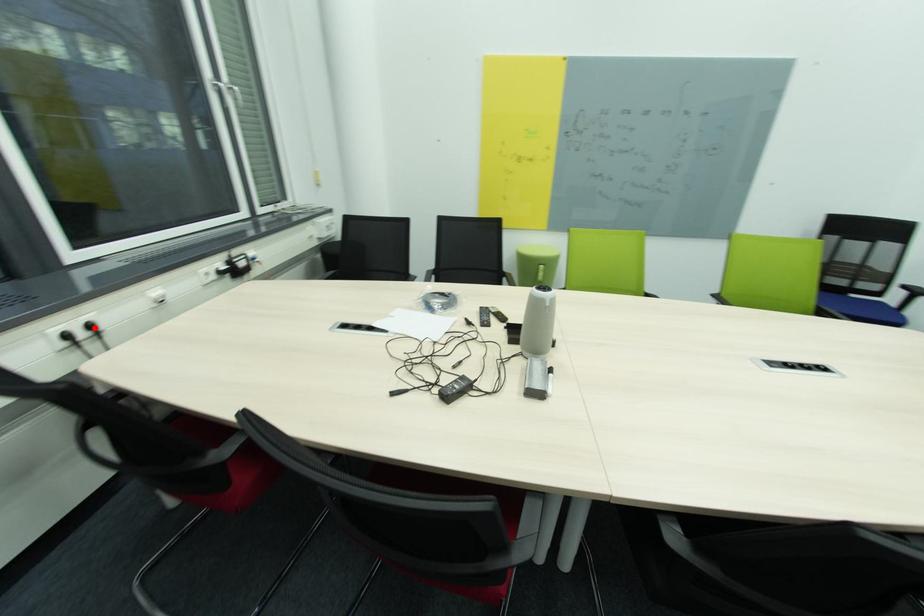
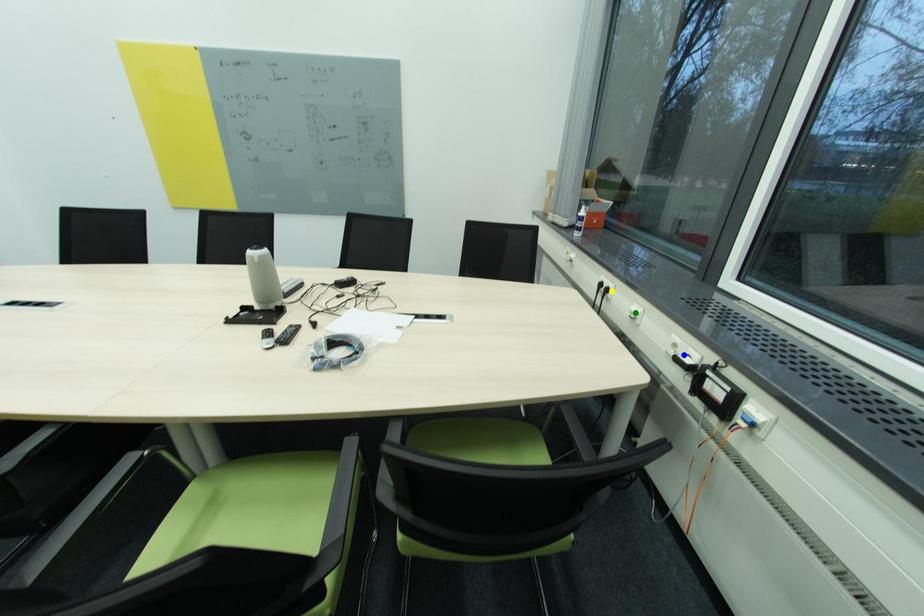
Question: I am providing you with two images of the same scene from different viewpoints. A red point is marked on the first image. You are given multiple points on the second image. Which point in image 2 represents the same 3d spot as the red point in image 1?

Choices:
 (A) green point
 (B) blue point
 (C) yellow point

Answer: (C)